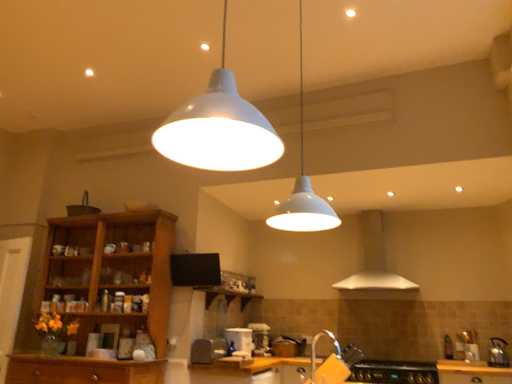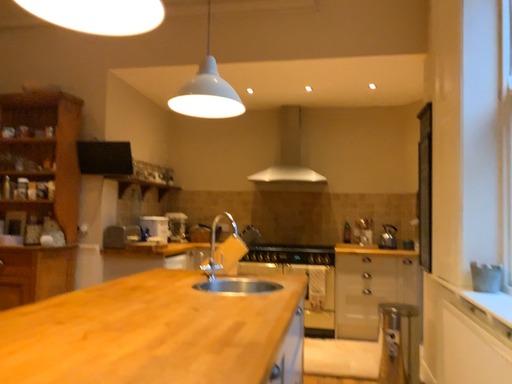
Question: How did the camera likely rotate when shooting the video?

Choices:
 (A) rotated downward
 (B) rotated upward

Answer: (A)